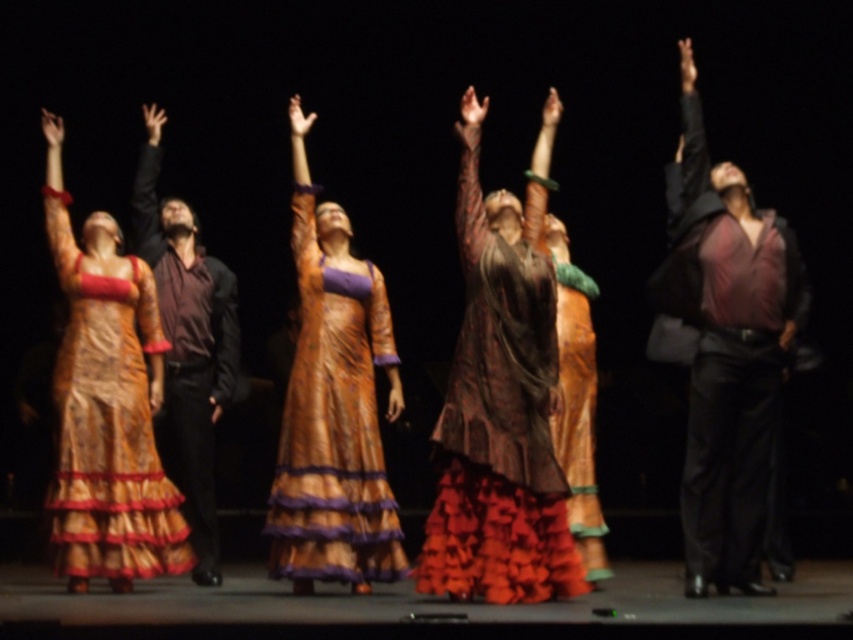
Who is higher up, matte burgundy shirt at center or matte brown shirt at left?

matte burgundy shirt at center is above.

Measure the distance between matte burgundy shirt at center and matte brown shirt at left.

matte burgundy shirt at center and matte brown shirt at left are 4.01 meters apart from each other.

The image size is (853, 640). In order to click on matte burgundy shirt at center in this screenshot , I will do `click(727, 349)`.

Locate an element on the screen. The height and width of the screenshot is (640, 853). matte burgundy shirt at center is located at coordinates (727, 349).

Does matte brown dress at center have a lesser width compared to matte burgundy shirt at center?

In fact, matte brown dress at center might be wider than matte burgundy shirt at center.

Does matte brown dress at center have a larger size compared to matte burgundy shirt at center?

Incorrect, matte brown dress at center is not larger than matte burgundy shirt at center.

What do you see at coordinates (502, 397) in the screenshot? This screenshot has height=640, width=853. I see `matte brown dress at center` at bounding box center [502, 397].

Identify the location of matte brown dress at center. This screenshot has height=640, width=853. (502, 397).

Between silky gold dress at left and matte brown shirt at left, which one has less height?

Standing shorter between the two is silky gold dress at left.

Is silky gold dress at left further to the viewer compared to matte brown shirt at left?

No.

The image size is (853, 640). What are the coordinates of `silky gold dress at left` in the screenshot? It's located at (106, 404).